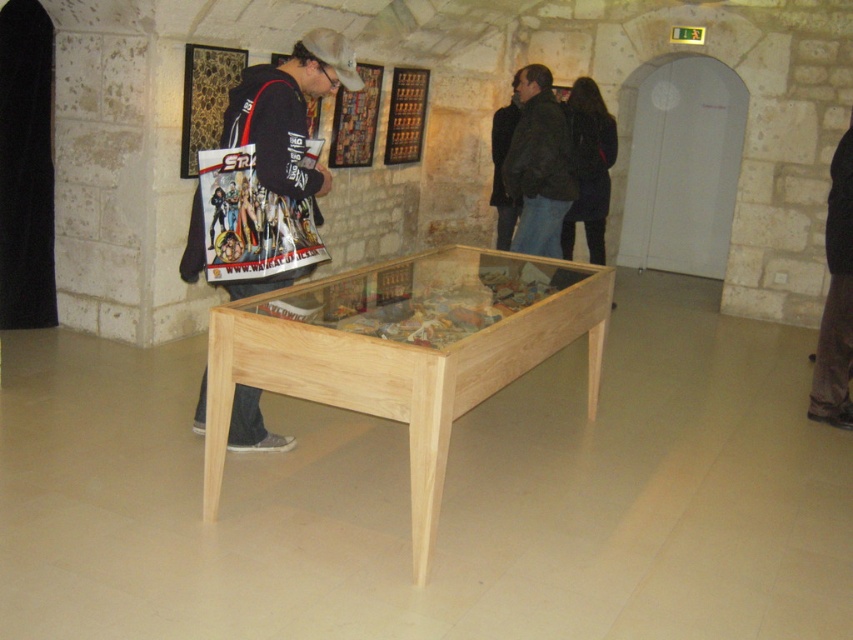
You are standing in the museum and see the matte black jacket at center. Can you estimate its position relative to the wooden table with a glass top?

The matte black jacket at center is located at point coordinates, so it is positioned to the left and slightly below the wooden table with a glass top placed centrally in the room.

Based on the photo, you are a photographer standing at the entrance of the museum. You want to take a photo of the natural wood table at center using a camera that requires a minimum distance of 2 meters between the camera and the subject for clear focus. Can you take a clear photo from your current position?

The natural wood table at center and camera are 2.50 meters apart, which is more than the required 2 meters. Therefore, you can take a clear photo from your current position.

You are standing in the museum and want to take a photo of the natural wood table at center without including the brown fabric pants at right in the frame. Is the table positioned in a way that allows this?

The natural wood table at center is below the brown fabric pants at right, so you can position your camera lower to capture the table without including the pants in the frame.